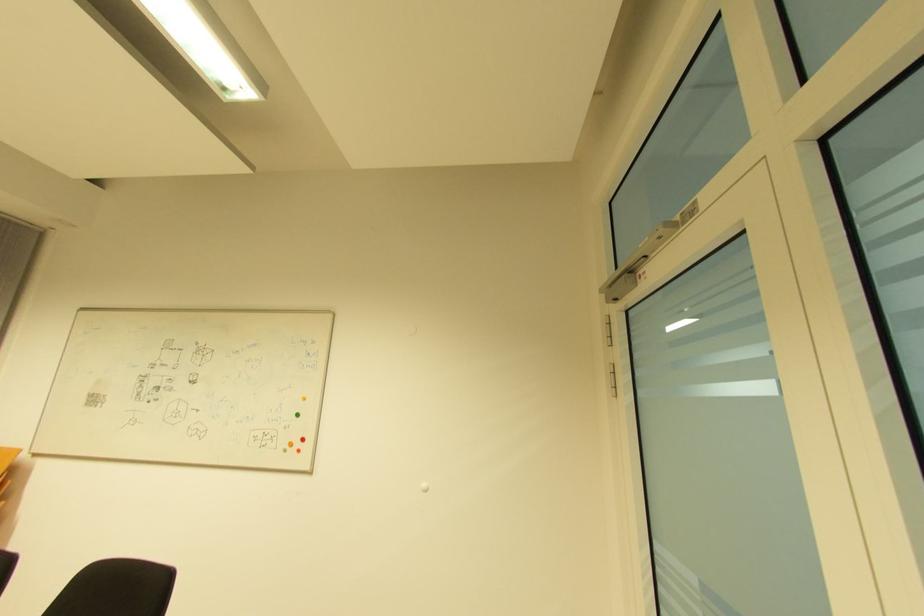
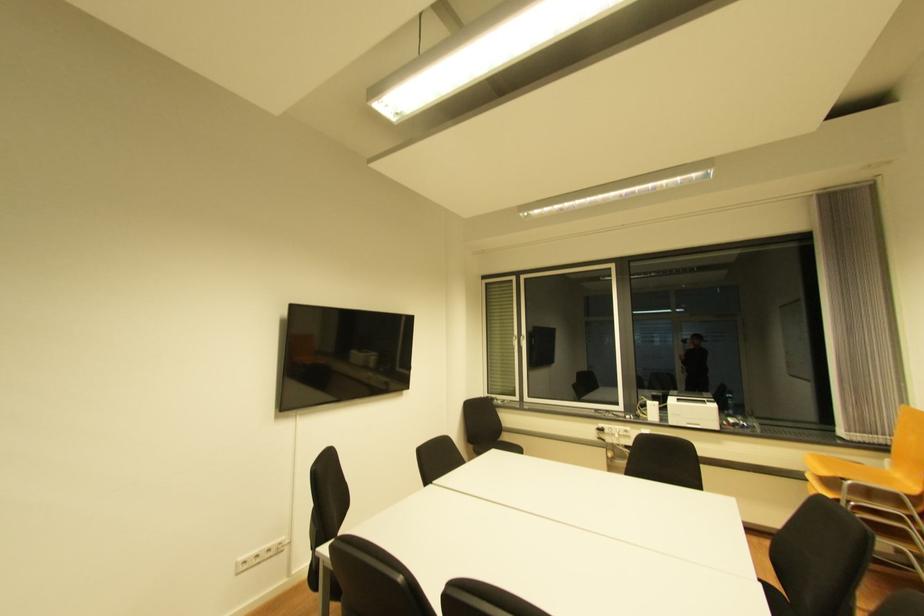
Question: How did the camera likely rotate?

Choices:
 (A) Left
 (B) Right
 (C) Up
 (D) Down

Answer: (A)